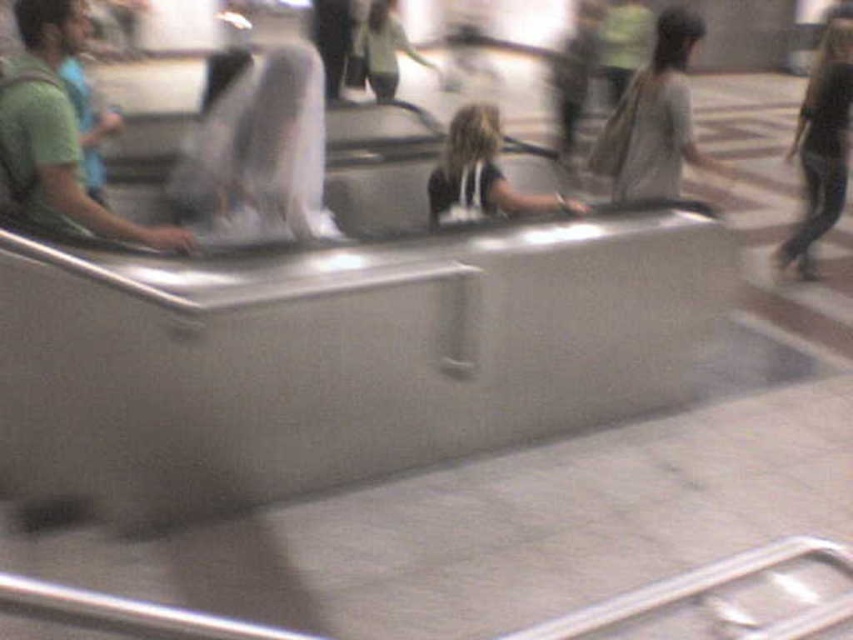
What do you see at coordinates (56, 132) in the screenshot? This screenshot has width=853, height=640. I see `green matte shirt at left` at bounding box center [56, 132].

Which is in front, point (28, 163) or point (379, 4)?

Point (28, 163) is more forward.

Locate an element on the screen. The width and height of the screenshot is (853, 640). green matte shirt at left is located at coordinates (56, 132).

Between gray fabric bag at right and dark blue jeans at right, which one has less height?

gray fabric bag at right is shorter.

Between gray fabric bag at right and dark blue jeans at right, which one appears on the left side from the viewer's perspective?

gray fabric bag at right is more to the left.

Who is more forward, (646,170) or (821,172)?

Point (646,170) is in front.

Where is `gray fabric bag at right`? gray fabric bag at right is located at coordinates (653, 116).

Does gray fabric bag at right appear on the left side of dark brown hair at center?

In fact, gray fabric bag at right is to the right of dark brown hair at center.

Where is `gray fabric bag at right`? gray fabric bag at right is located at coordinates (653, 116).

Does point (656, 80) lie in front of point (471, 145)?

No, (656, 80) is further to viewer.

Find the location of `gray fabric bag at right`. gray fabric bag at right is located at coordinates (653, 116).